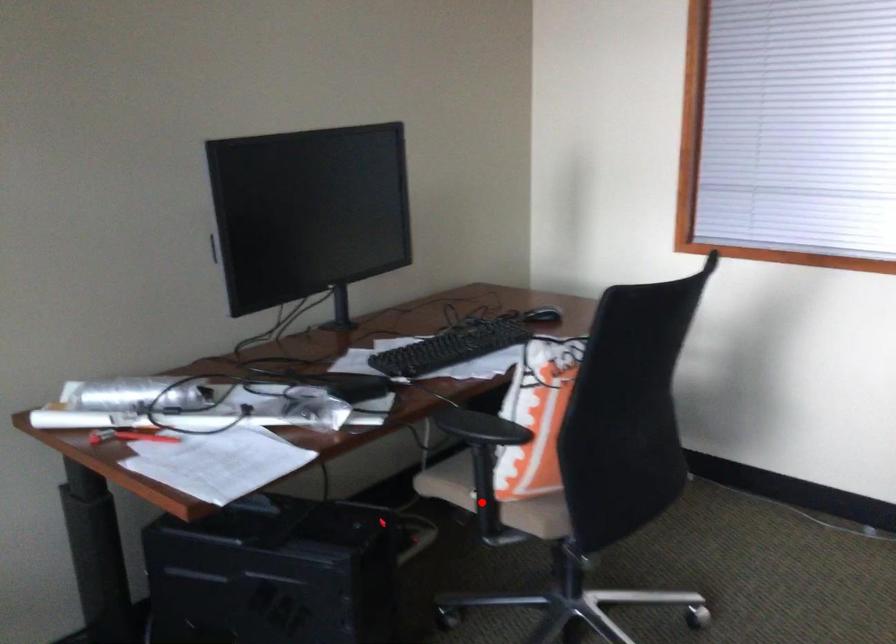
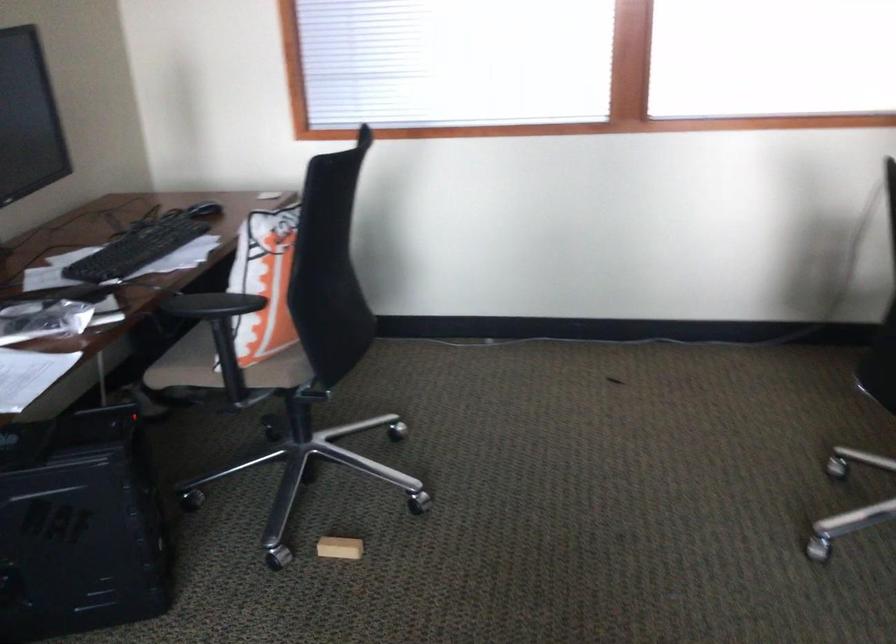
Find the pixel in the second image that matches the highlighted location in the first image.

(228, 370)